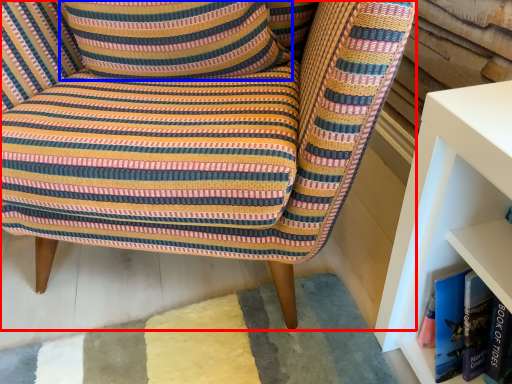
Question: Which of the following is the farthest to the observer, chair (highlighted by a red box) or pillow (highlighted by a blue box)?

Choices:
 (A) chair
 (B) pillow

Answer: (B)